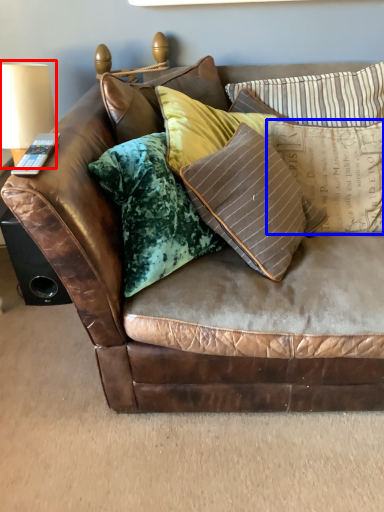
Question: Which object is closer to the camera taking this photo, table lamp (highlighted by a red box) or pillow (highlighted by a blue box)?

Choices:
 (A) table lamp
 (B) pillow

Answer: (B)